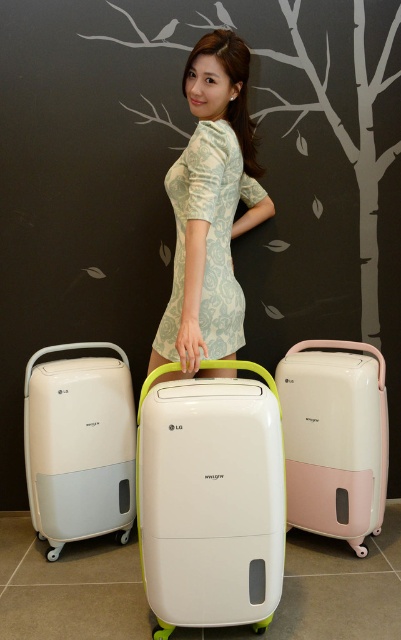
Question: Which object appears farthest from the camera in this image?

Choices:
 (A) light blue floral dress at center
 (B) white matte suitcase at center

Answer: (A)

Question: Is light blue floral dress at center to the left of matte white suitcase at center from the viewer's perspective?

Choices:
 (A) no
 (B) yes

Answer: (B)

Question: Which of the following is the farthest from the observer?

Choices:
 (A) white matte suitcase at center
 (B) light blue floral dress at center
 (C) matte white suitcase at center
 (D) white matte dehumidifier at left

Answer: (D)

Question: Does light blue floral dress at center appear on the right side of matte white suitcase at center?

Choices:
 (A) no
 (B) yes

Answer: (A)

Question: Which point is closer to the camera taking this photo?

Choices:
 (A) (190, 349)
 (B) (28, 372)
 (C) (214, 515)
 (D) (348, 420)

Answer: (C)

Question: Is white matte suitcase at center positioned in front of matte white suitcase at center?

Choices:
 (A) yes
 (B) no

Answer: (A)